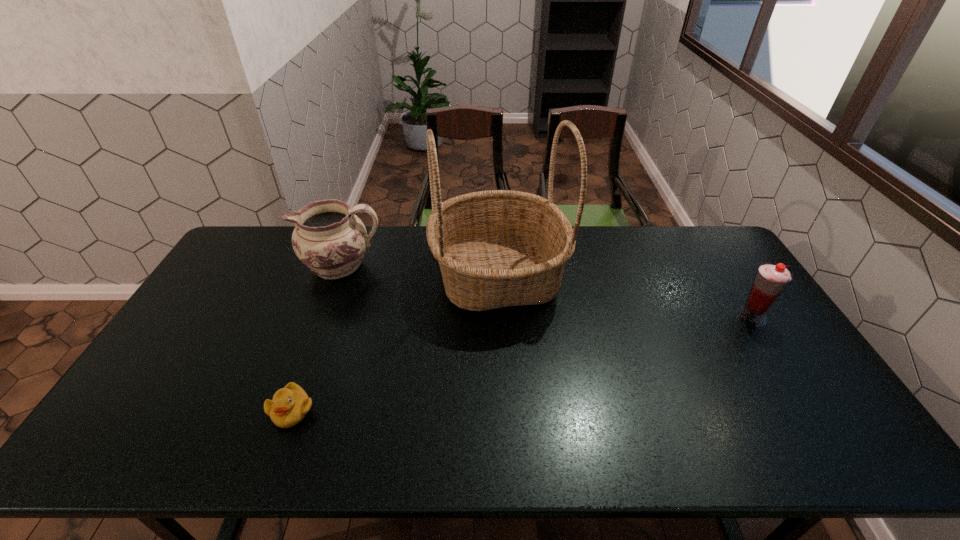
Where is `the tallest object`? the tallest object is located at coordinates (496, 248).

Find the location of a particular element. basket is located at coordinates (496, 248).

The height and width of the screenshot is (540, 960). I want to click on pitcher, so click(329, 239).

Where is `the rightmost object`? Image resolution: width=960 pixels, height=540 pixels. the rightmost object is located at coordinates (771, 279).

I want to click on duckling, so click(x=289, y=406).

The height and width of the screenshot is (540, 960). Find the location of `the shortest object`. the shortest object is located at coordinates (289, 406).

Identify the location of free location located on the right of the tallest object. (634, 276).

In order to click on free spot located 0.060m on the spout of the pitcher in this screenshot , I will do `click(282, 266)`.

I want to click on blank area located on the spout of the pitcher, so coord(248,266).

Locate an element on the screen. This screenshot has height=540, width=960. free space located on the spout of the pitcher is located at coordinates click(x=230, y=266).